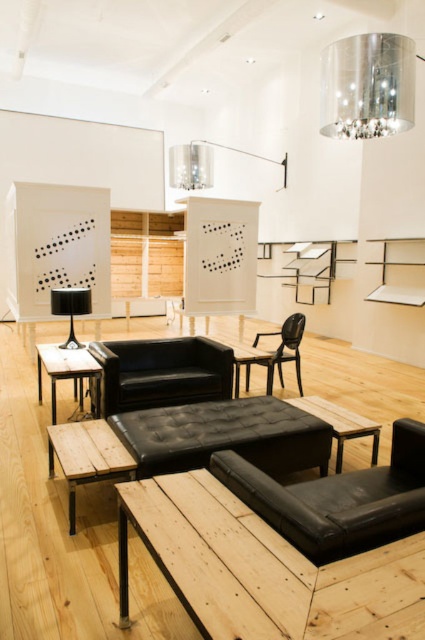
You are planning to install a new light fixture in your living room. The current polished chrome chandelier at upper center is smaller than the black leather couch at center. If you want to replace the chandelier with one that is larger than the couch, is this feasible based on the current space?

The polished chrome chandelier at upper center is currently smaller than the black leather couch at center. However, replacing it with a chandelier larger than the couch may not be feasible as the existing space might not accommodate a fixture of that size without compromising the room layout.

Looking at this image, you are planning to move a 1.8 meters wide sofa into this living room. You see the black leather couch at center and the wooden plank table at lower left. Which object should you avoid placing the new sofa next to to ensure there is enough space?

The black leather couch at center might be wider than the wooden plank table at lower left, so placing the new sofa next to the black leather couch at center may not leave enough space. Therefore, you should avoid placing the new sofa next to the black leather couch at center.